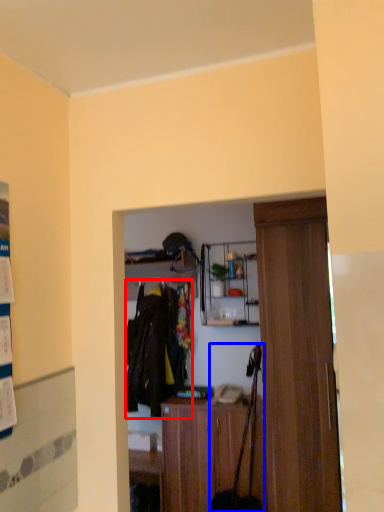
Question: Which point is further to the camera, clothing (highlighted by a red box) or luggage (highlighted by a blue box)?

Choices:
 (A) clothing
 (B) luggage

Answer: (A)